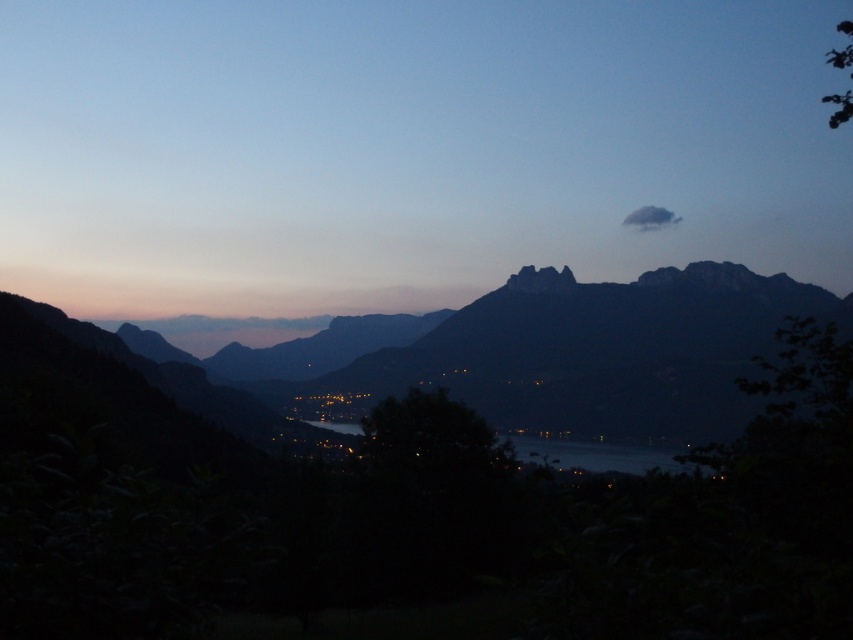
Question: Which object is closer to the camera taking this photo?

Choices:
 (A) dark gray rocky mountain range at center
 (B) glistening water at center

Answer: (B)

Question: Which object is closer to the camera taking this photo?

Choices:
 (A) glistening water at center
 (B) dark gray rocky mountain range at center

Answer: (A)

Question: Can you confirm if dark gray rocky mountain range at center is thinner than glistening water at center?

Choices:
 (A) no
 (B) yes

Answer: (A)

Question: Does dark gray rocky mountain range at center lie in front of glistening water at center?

Choices:
 (A) no
 (B) yes

Answer: (A)

Question: Does dark gray rocky mountain range at center have a greater width compared to glistening water at center?

Choices:
 (A) yes
 (B) no

Answer: (A)